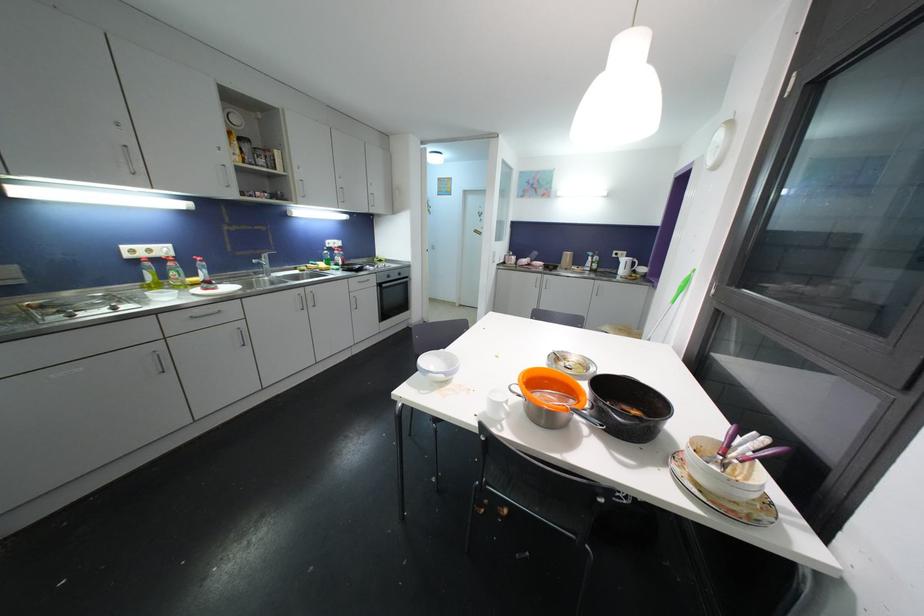
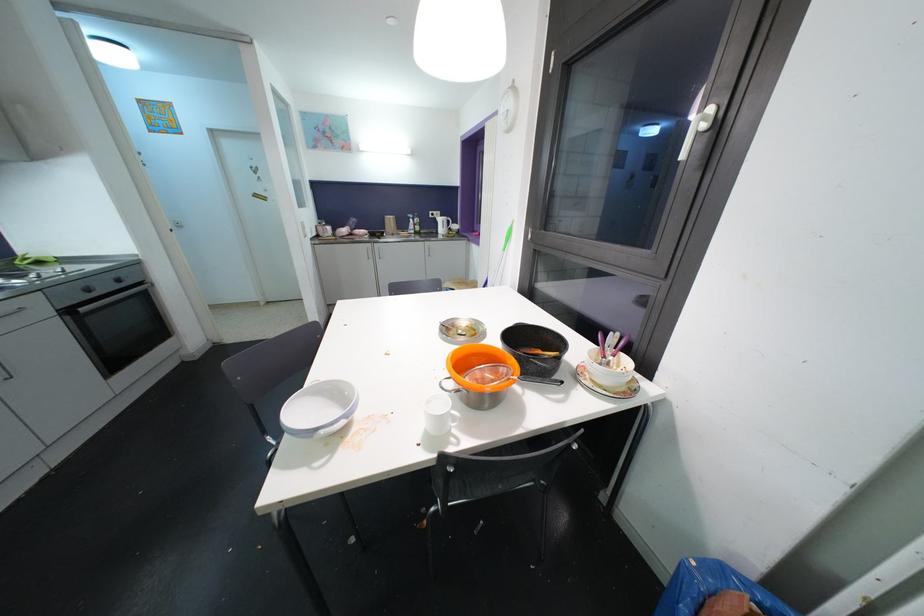
Where in the second image is the point corresponding to (x=560, y=360) from the first image?

(451, 331)